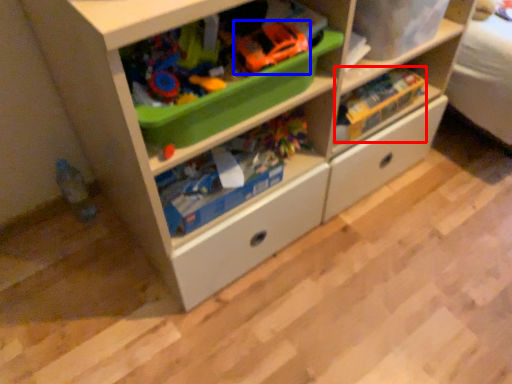
Question: Among these objects, which one is farthest to the camera, toy (highlighted by a red box) or toy car (highlighted by a blue box)?

Choices:
 (A) toy
 (B) toy car

Answer: (A)